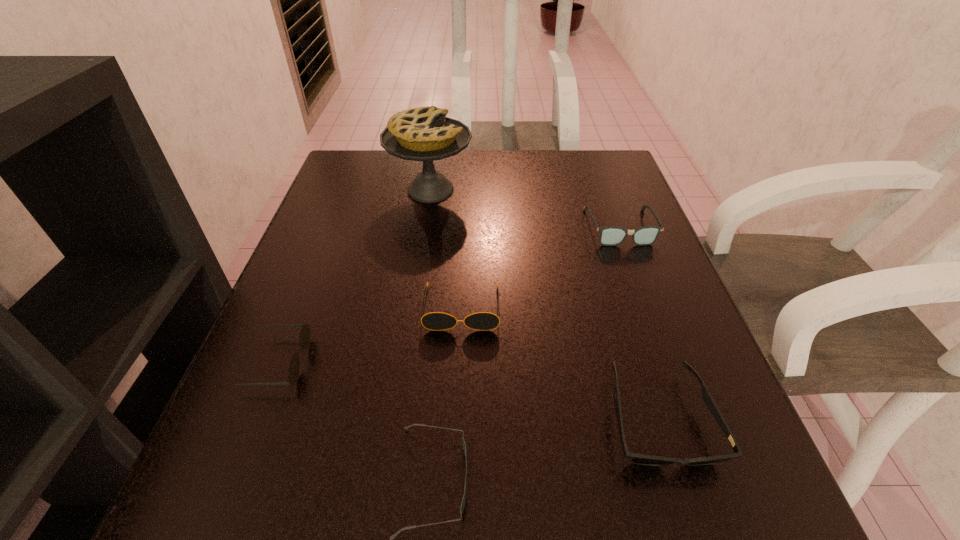
Locate an element on the screen. pie is located at coordinates (424, 134).

This screenshot has height=540, width=960. Find the location of `spectacles`. spectacles is located at coordinates (609, 236).

I want to click on the fourth nearest object, so click(436, 321).

The image size is (960, 540). I want to click on the rightmost sunglasses, so click(x=640, y=459).

Identify the location of the leftmost sunglasses. (304, 339).

Identify the location of free space located 0.120m on the cut side of the pie. (521, 190).

The width and height of the screenshot is (960, 540). Find the location of `vacant area located on the face of the spectacles`. vacant area located on the face of the spectacles is located at coordinates (665, 352).

Find the location of a particular element. The width and height of the screenshot is (960, 540). vacant area located on the front-facing side of the farthest sunglasses is located at coordinates (455, 480).

Image resolution: width=960 pixels, height=540 pixels. Find the location of `vacant region located on the front-facing side of the rightmost sunglasses`. vacant region located on the front-facing side of the rightmost sunglasses is located at coordinates (692, 525).

Where is `free space located 0.060m on the front-facing side of the leftmost object`? Image resolution: width=960 pixels, height=540 pixels. free space located 0.060m on the front-facing side of the leftmost object is located at coordinates (341, 362).